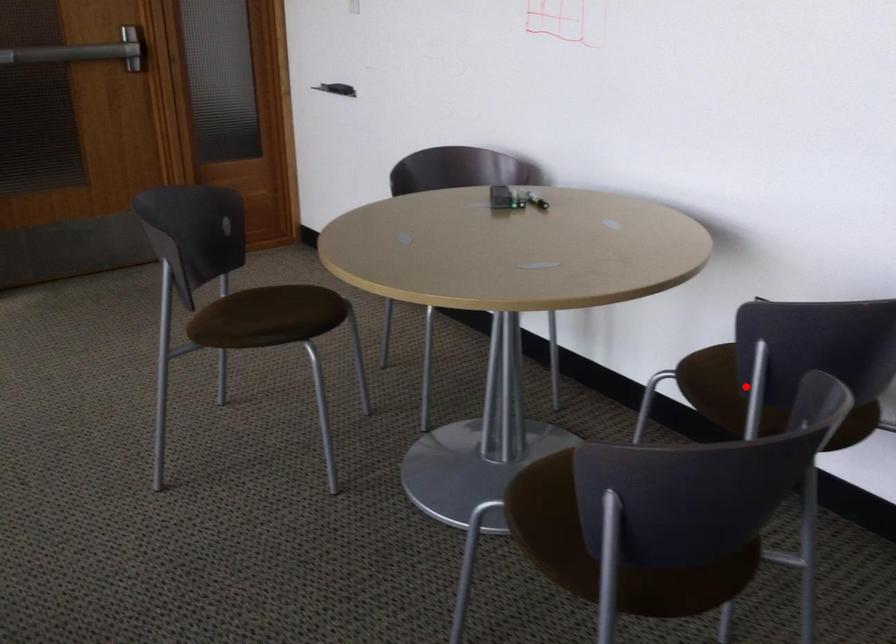
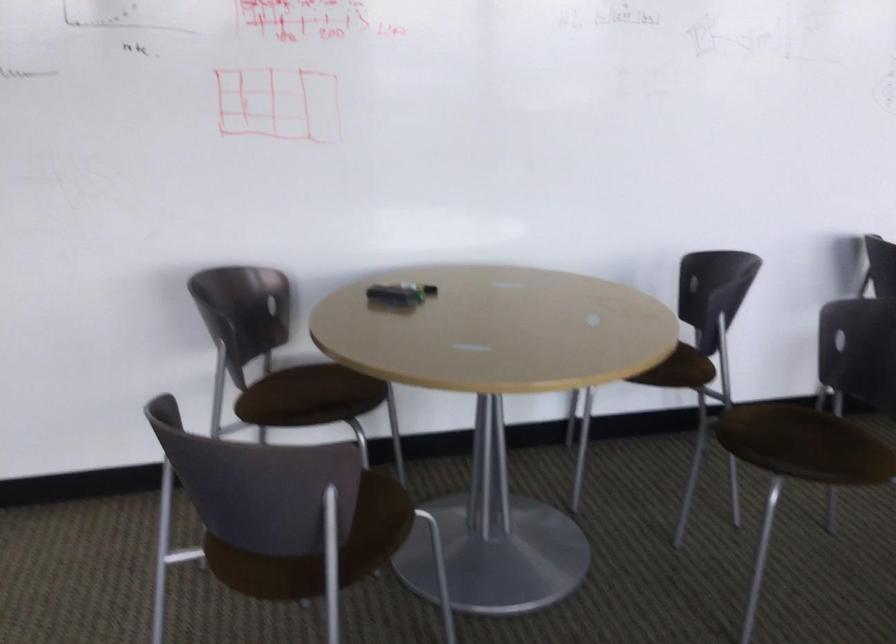
Question: I am providing you with two images of the same scene from different viewpoints. A red point is marked on the first image. Is the red point's position out of view in image 2?

Choices:
 (A) Yes
 (B) No

Answer: (A)